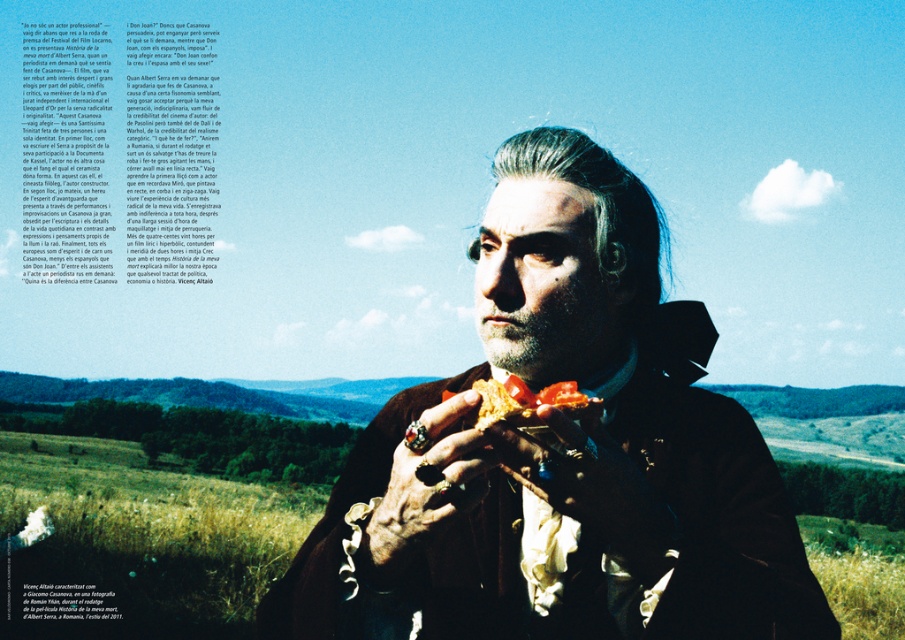
Measure the distance from velvet brown coat at center to rusty metal hand at center.

7.22 inches

Who is taller, velvet brown coat at center or rusty metal hand at center?

velvet brown coat at center

Is point (686, 381) farther from camera compared to point (456, 513)?

That is True.

Locate an element on the screen. velvet brown coat at center is located at coordinates (559, 456).

Is point (627, 540) farther from viewer compared to point (500, 403)?

Yes, point (627, 540) is farther from viewer.

Between rustic leather glove at center and golden crumbly bread at center, which one has less height?

golden crumbly bread at center

In order to click on rustic leather glove at center in this screenshot , I will do `click(589, 481)`.

Can you confirm if velvet brown coat at center is positioned below golden crumbly bread at center?

Incorrect, velvet brown coat at center is not positioned below golden crumbly bread at center.

Between velvet brown coat at center and golden crumbly bread at center, which one appears on the right side from the viewer's perspective?

velvet brown coat at center is more to the right.

The image size is (905, 640). What do you see at coordinates (559, 456) in the screenshot? I see `velvet brown coat at center` at bounding box center [559, 456].

The height and width of the screenshot is (640, 905). What are the coordinates of `velvet brown coat at center` in the screenshot? It's located at (559, 456).